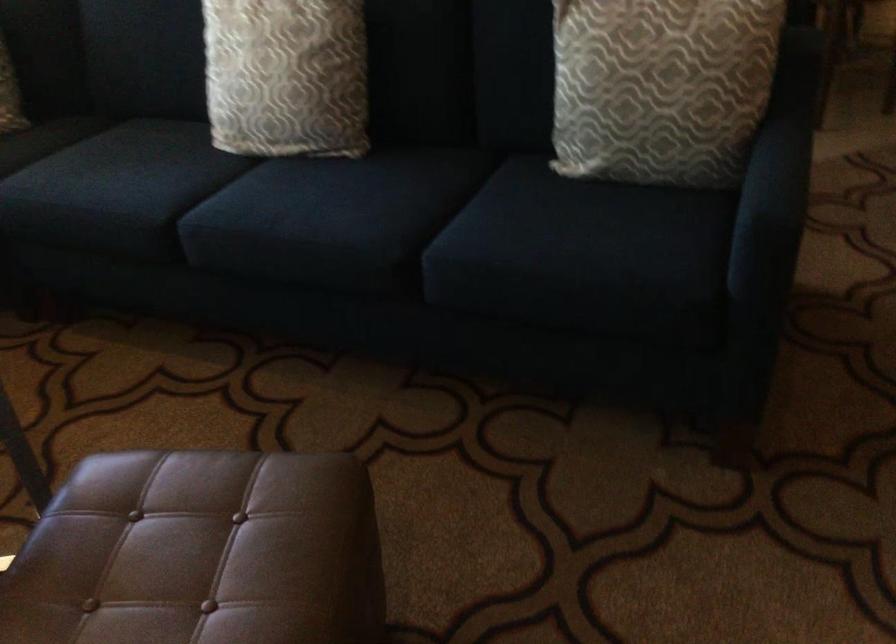
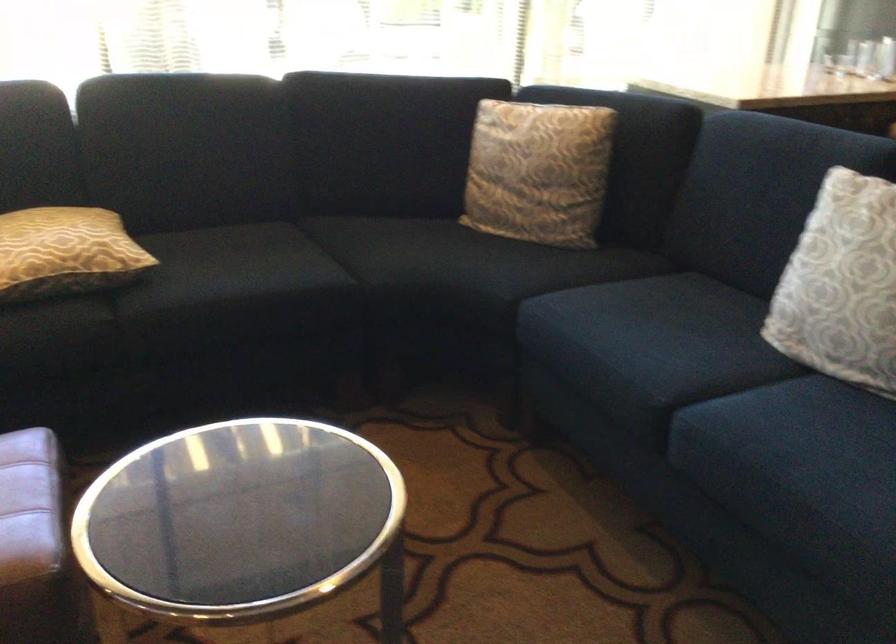
The point at (259, 82) is marked in the first image. Where is the corresponding point in the second image?

(841, 285)